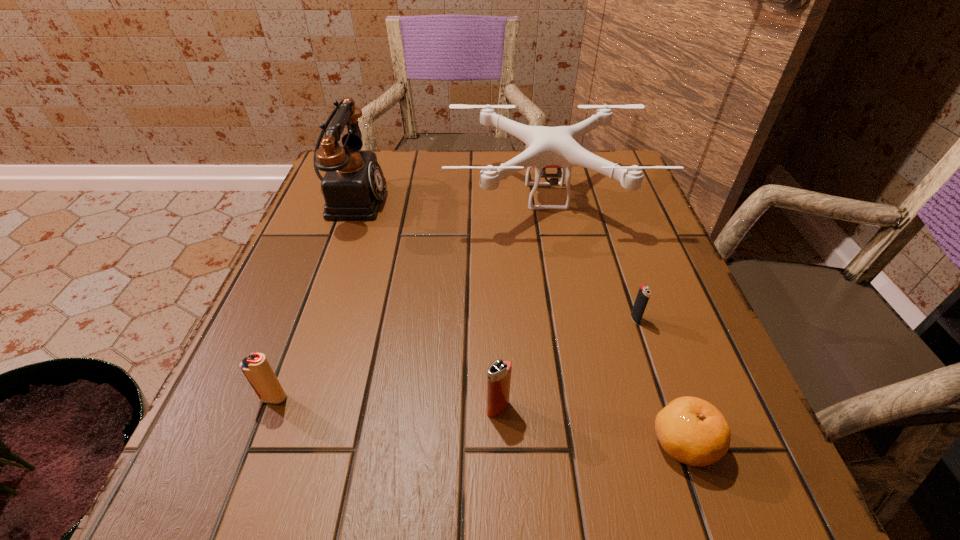
Where is `the tallest object`? the tallest object is located at coordinates (353, 186).

The height and width of the screenshot is (540, 960). Identify the location of drone. (548, 147).

The image size is (960, 540). I want to click on the second igniter from left to right, so click(499, 372).

The height and width of the screenshot is (540, 960). I want to click on the leftmost igniter, so pos(256,368).

Identify the location of the fourth nearest object. (644, 292).

Where is `the shortest igniter`? The width and height of the screenshot is (960, 540). the shortest igniter is located at coordinates (644, 292).

Locate an element on the screen. The height and width of the screenshot is (540, 960). clementine is located at coordinates (691, 430).

Identify the location of free point located on the front of the tallest object at the rotary dial. (553, 198).

The image size is (960, 540). Find the location of `vacant space situated on the top of the drone`. vacant space situated on the top of the drone is located at coordinates (586, 400).

Where is `vacant space located 0.260m on the back of the second igniter from left to right`? The height and width of the screenshot is (540, 960). vacant space located 0.260m on the back of the second igniter from left to right is located at coordinates (493, 280).